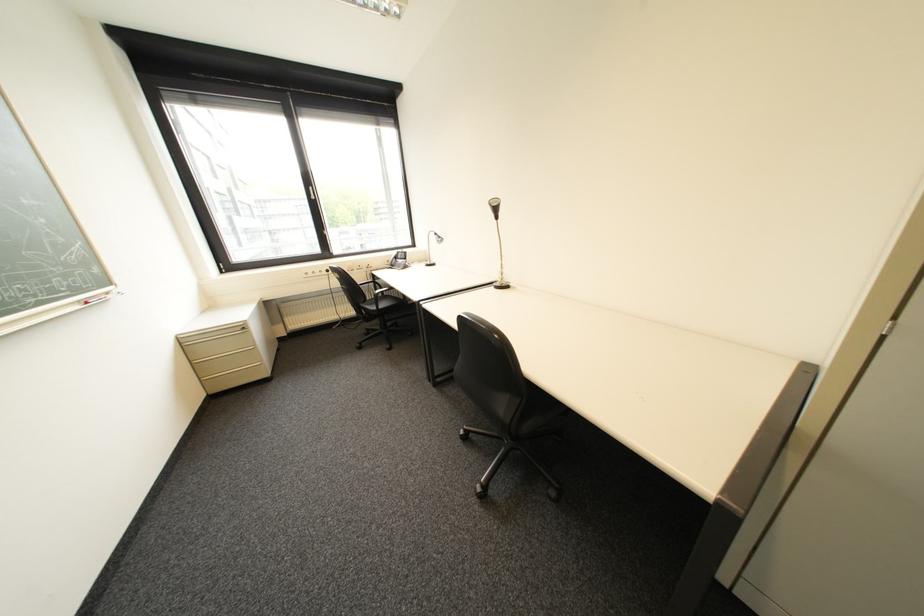
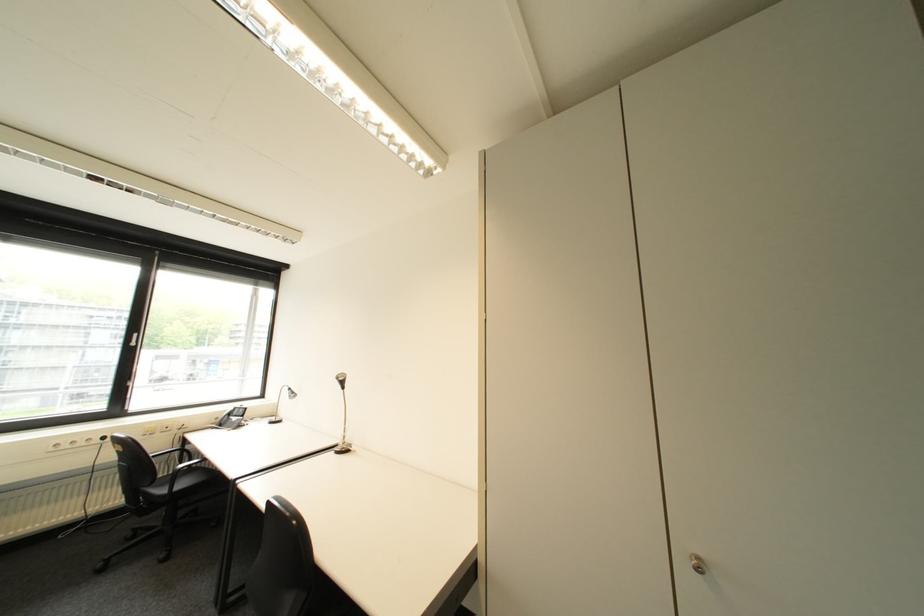
Find the pixel in the second image that matches [391,307] in the first image.

(187, 488)